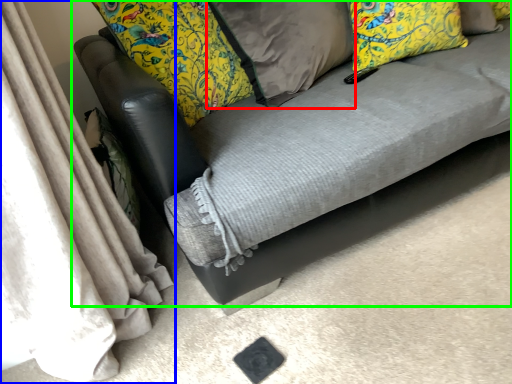
Question: Based on their relative distances, which object is farther from pillow (highlighted by a red box)? Choose from curtain (highlighted by a blue box) and studio couch (highlighted by a green box).

Choices:
 (A) curtain
 (B) studio couch

Answer: (A)